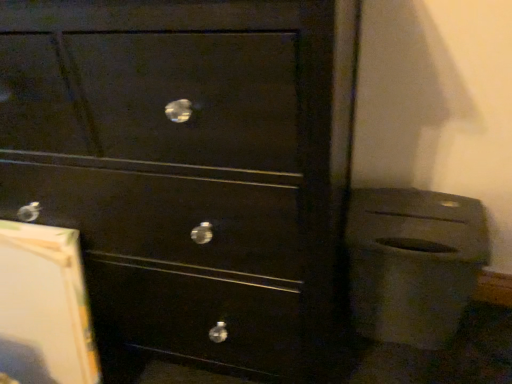
What is the approximate width of matte black drawer at center?

matte black drawer at center is 19.76 inches wide.

What do you see at coordinates (186, 174) in the screenshot? I see `matte black drawer at center` at bounding box center [186, 174].

Where is `matte black drawer at center`? This screenshot has width=512, height=384. matte black drawer at center is located at coordinates (186, 174).

The height and width of the screenshot is (384, 512). Find the location of `matte black trash can at lower right`. matte black trash can at lower right is located at coordinates (413, 263).

What is the approximate width of matte black trash can at lower right?

The width of matte black trash can at lower right is 20.66 centimeters.

This screenshot has height=384, width=512. What do you see at coordinates (413, 263) in the screenshot? I see `matte black trash can at lower right` at bounding box center [413, 263].

Locate an element on the screen. matte black drawer at center is located at coordinates (186, 174).

Can you confirm if matte black drawer at center is positioned to the right of matte black trash can at lower right?

In fact, matte black drawer at center is to the left of matte black trash can at lower right.

Who is more distant, matte black drawer at center or matte black trash can at lower right?

matte black trash can at lower right.

Does point (249, 110) appear closer or farther from the camera than point (387, 327)?

Point (249, 110) is positioned closer to the camera compared to point (387, 327).

From the image's perspective, which one is positioned lower, matte black drawer at center or matte black trash can at lower right?

matte black trash can at lower right is shown below in the image.

From a real-world perspective, which is physically above, matte black drawer at center or matte black trash can at lower right?

matte black drawer at center, from a real-world perspective.

Looking at their sizes, would you say matte black drawer at center is wider or thinner than matte black trash can at lower right?

In the image, matte black drawer at center appears to be wider than matte black trash can at lower right.

Is matte black drawer at center taller than matte black trash can at lower right?

Yes.

Looking at the image, does matte black drawer at center seem bigger or smaller compared to matte black trash can at lower right?

Clearly, matte black drawer at center is larger in size than matte black trash can at lower right.

Is matte black drawer at center situated inside matte black trash can at lower right or outside?

The correct answer is: outside.

Is the surface of matte black drawer at center in direct contact with matte black trash can at lower right?

matte black drawer at center and matte black trash can at lower right are not in contact.

Is matte black drawer at center facing towards matte black trash can at lower right?

No, matte black drawer at center does not turn towards matte black trash can at lower right.

How many degrees apart are the facing directions of matte black drawer at center and matte black trash can at lower right?

The angle between the facing direction of matte black drawer at center and the facing direction of matte black trash can at lower right is 0.928 degrees.

How much distance is there between matte black drawer at center and matte black trash can at lower right?

matte black drawer at center and matte black trash can at lower right are 16.36 inches apart from each other.

Locate an element on the screen. chest of drawers on the left of matte black trash can at lower right is located at coordinates (186, 174).

Considering the relative positions of matte black trash can at lower right and matte black drawer at center in the image provided, is matte black trash can at lower right to the right of matte black drawer at center from the viewer's perspective?

Yes.

In the scene shown: Is matte black trash can at lower right positioned behind matte black drawer at center?

That is True.

Which point is more distant from viewer, [378,335] or [266,81]?

Positioned behind is point [378,335].

From the image's perspective, is matte black trash can at lower right on matte black drawer at center?

Incorrect, from the image's perspective, matte black trash can at lower right is lower than matte black drawer at center.

From a real-world perspective, which is physically above, matte black trash can at lower right or matte black drawer at center?

matte black drawer at center, from a real-world perspective.

In terms of width, does matte black trash can at lower right look wider or thinner when compared to matte black drawer at center?

Considering their sizes, matte black trash can at lower right looks slimmer than matte black drawer at center.

Considering the sizes of objects matte black trash can at lower right and matte black drawer at center in the image provided, who is taller, matte black trash can at lower right or matte black drawer at center?

With more height is matte black drawer at center.

Between matte black trash can at lower right and matte black drawer at center, which one has larger size?

With larger size is matte black drawer at center.

Is matte black trash can at lower right not within matte black drawer at center?

That's correct, matte black trash can at lower right is outside of matte black drawer at center.

Is matte black trash can at lower right far from matte black drawer at center?

No, matte black trash can at lower right is not far away from matte black drawer at center.

Consider the image. Is matte black trash can at lower right facing towards matte black drawer at center?

No, matte black trash can at lower right is not turned towards matte black drawer at center.

How different are the orientations of matte black trash can at lower right and matte black drawer at center in degrees?

There is a 0.928-degree angle between the facing directions of matte black trash can at lower right and matte black drawer at center.

What are the coordinates of `waste container on the right of matte black drawer at center` in the screenshot? It's located at (413, 263).

The width and height of the screenshot is (512, 384). Identify the location of waste container that is behind the matte black drawer at center. [x=413, y=263].

You are a GUI agent. You are given a task and a screenshot of the screen. Output one action in this format:
    pyautogui.click(x=<x>, y=<y>)
    Task: Click on the chest of drawers above the matte black trash can at lower right (from a real-world perspective)
    The height and width of the screenshot is (384, 512).
    Given the screenshot: What is the action you would take?
    pyautogui.click(x=186, y=174)